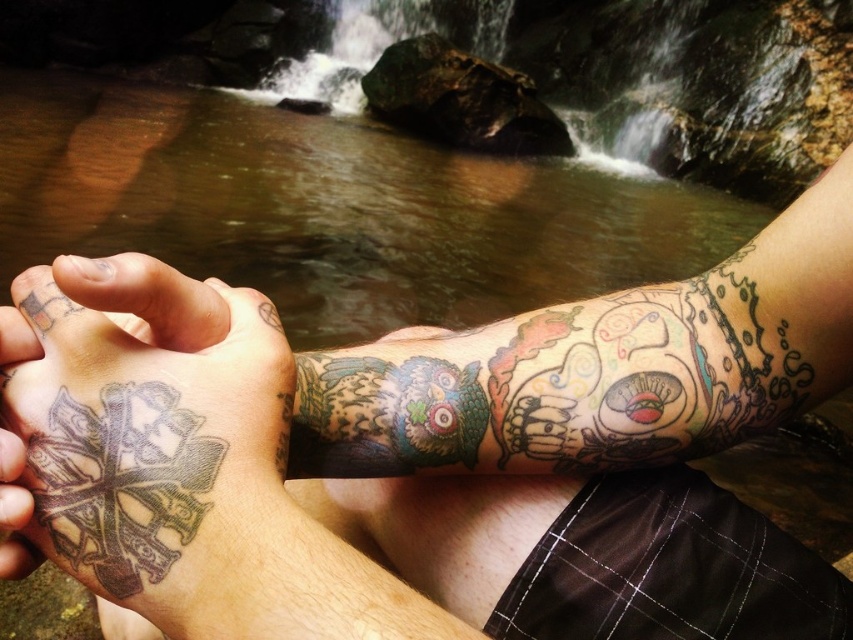
You are a tattoo artist assessing the placement of the gray ink tattoo at lower left and the multicolored tattooed hand at lower left. Based on their positions, which tattoo is closer to the wrist?

The gray ink tattoo at lower left is located below the multicolored tattooed hand at lower left, so it is closer to the wrist.

You are a tattoo artist assessing the placement of tattoos on a client. The client has a gray ink tattoo at lower left and a multicolored tattooed hand at lower left. Which tattoo occupies more space on the skin?

The gray ink tattoo at lower left is larger in size than the multicolored tattooed hand at lower left, so it occupies more space on the skin.

You are a tattoo artist reviewing a client photo. The client wants to add a new tattoo at coordinate point 0.720, 0.212. The existing tattoos include a gray ink tattoo at lower left. Based on the scene description, is this new tattoo location already occupied by an existing tattoo?

The gray ink tattoo at lower left is positioned at point (180, 460), so the new tattoo location is already occupied by the gray ink tattoo at lower left.